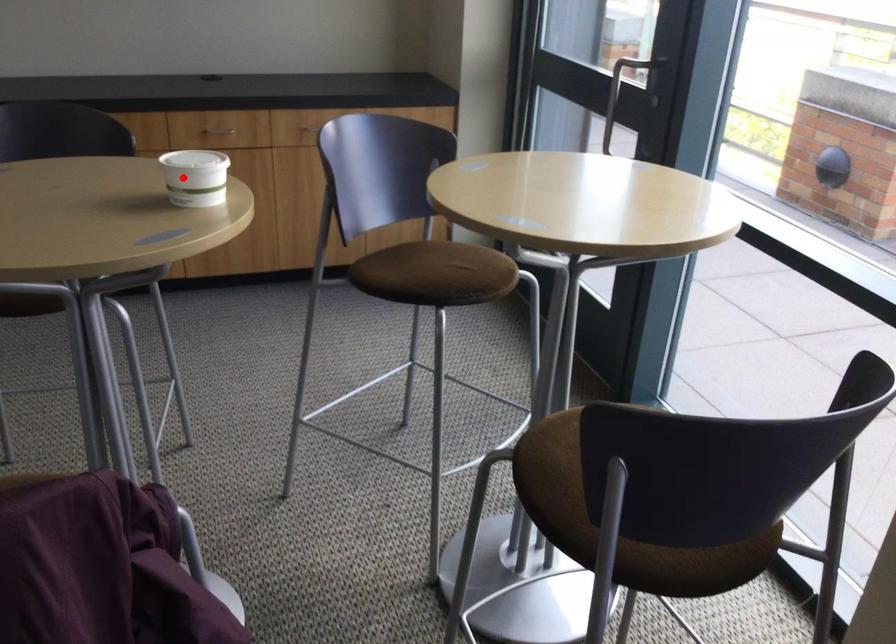
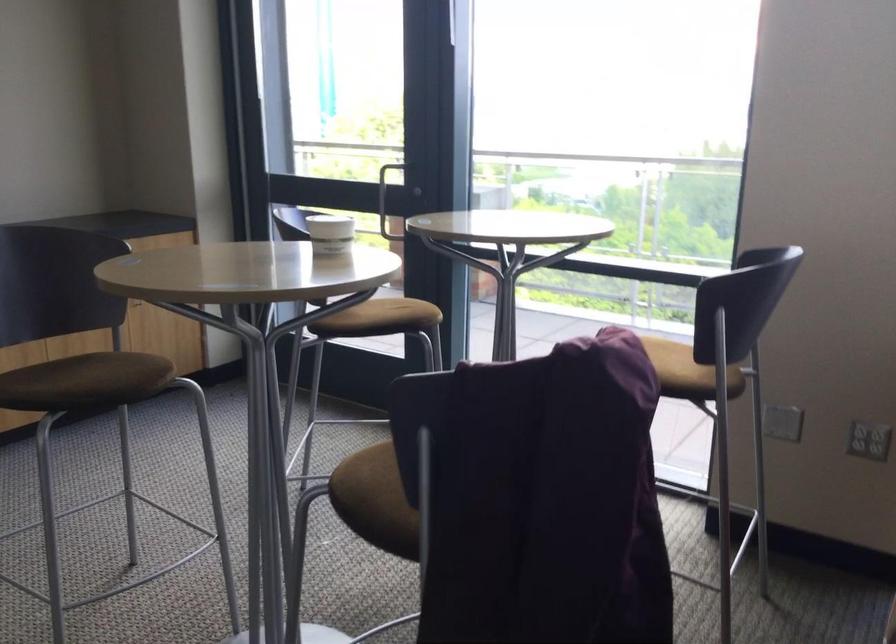
Find the pixel in the second image that matches the highlighted location in the first image.

(330, 234)